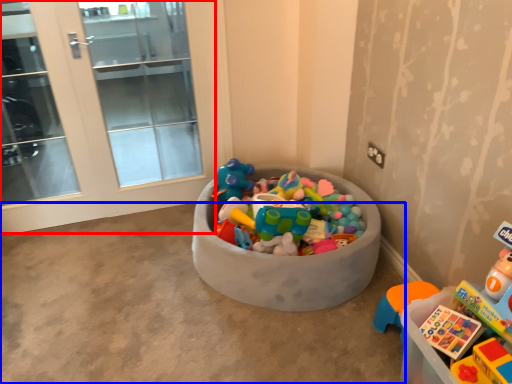
Question: Which object is further to the camera taking this photo, screen door (highlighted by a red box) or concrete (highlighted by a blue box)?

Choices:
 (A) screen door
 (B) concrete

Answer: (A)